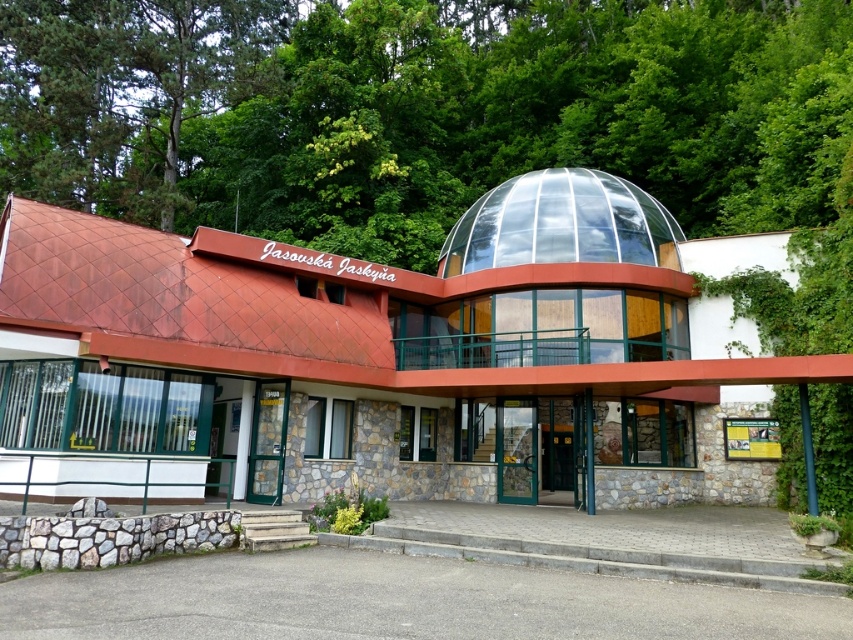
You are standing at the entrance of the modern building and want to water the green leafy tree at upper center. The water hose you have can reach up to 15 meters. Can you water the tree without moving closer?

The green leafy tree at upper center is 15.19 meters away from the viewer. Since the hose can only reach up to 15 meters, you cannot water the tree without moving closer.

You are standing at the entrance of the modern building and looking towards the green leafy tree at upper center and the green glass door at center. Which object is located above the other?

The green leafy tree at upper center is positioned over the green glass door at center, so the green leafy tree at upper center is above the green glass door at center.